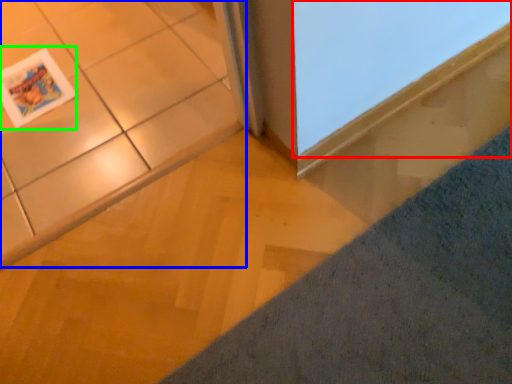
Question: Which object is the closest to the window (highlighted by a red box)? Choose among these: ceramic tile (highlighted by a blue box) or magazine (highlighted by a green box).

Choices:
 (A) ceramic tile
 (B) magazine

Answer: (A)